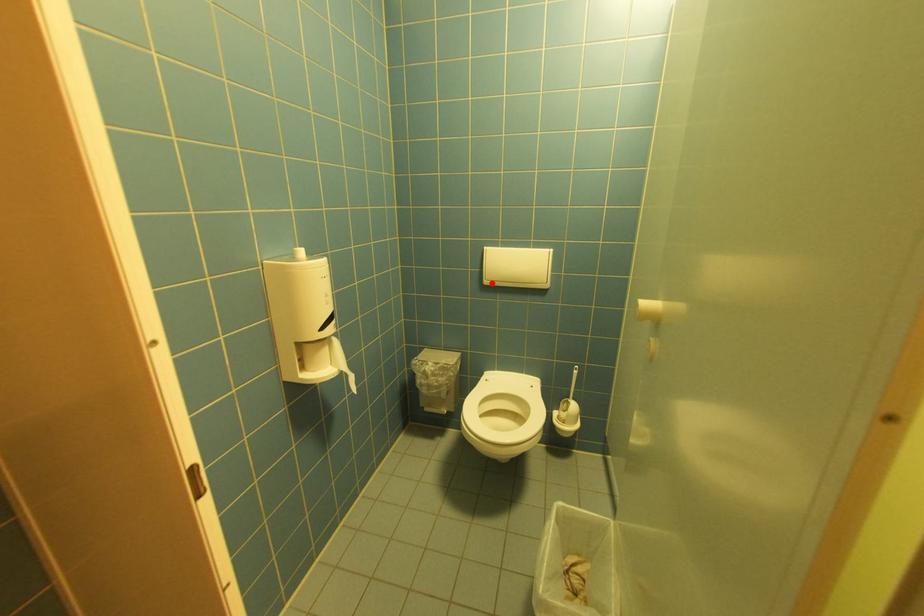
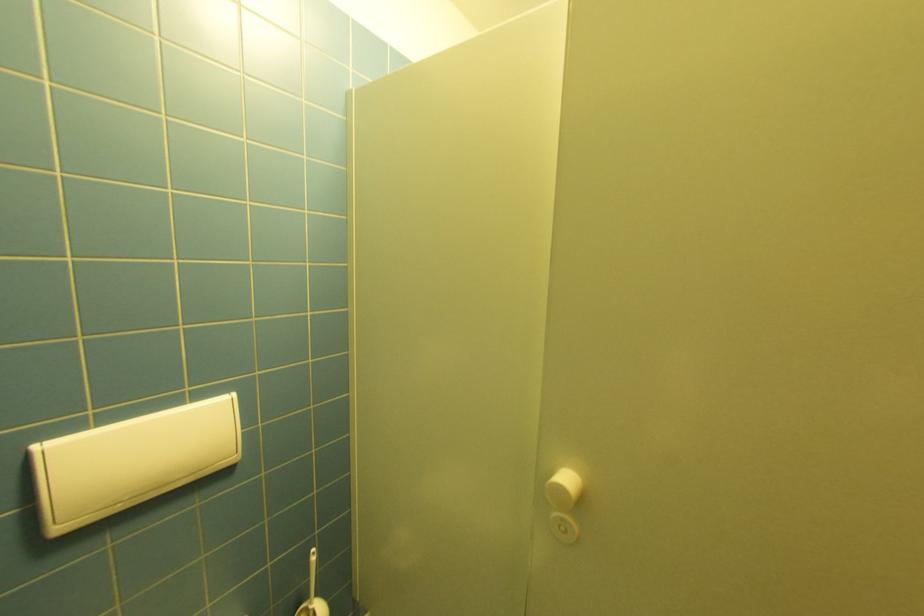
The point at the highlighted location is marked in the first image. Where is the corresponding point in the second image?

(66, 530)